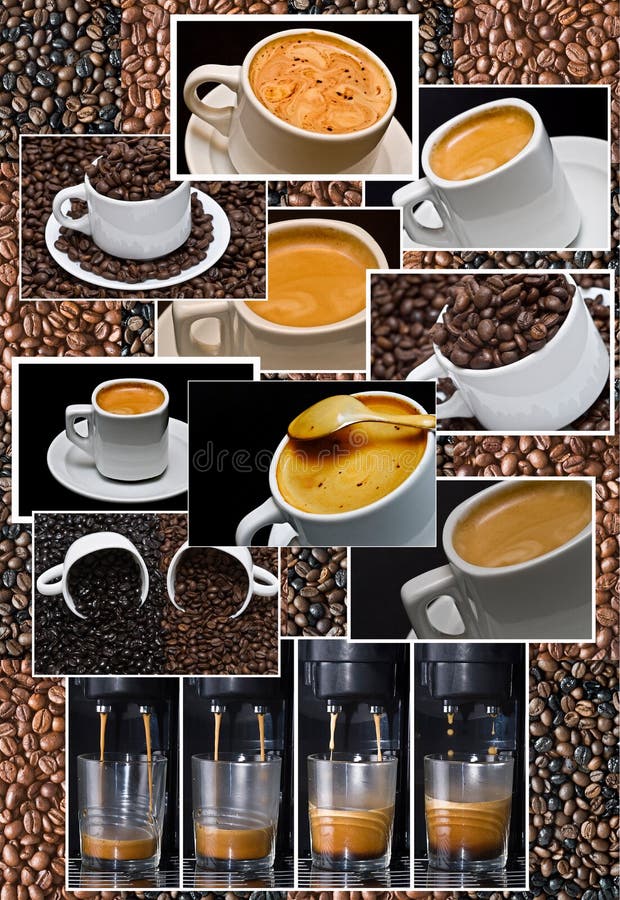
Find the location of a particular element. The width and height of the screenshot is (620, 900). mug handles is located at coordinates (66, 195), (203, 76), (409, 193), (428, 361), (188, 304), (74, 408), (254, 518), (418, 585), (270, 574), (51, 567).